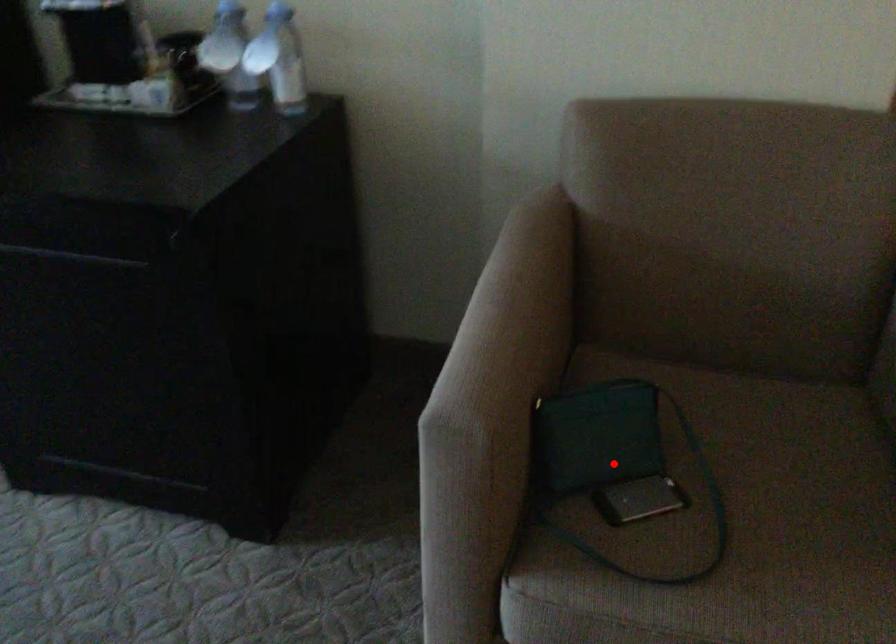
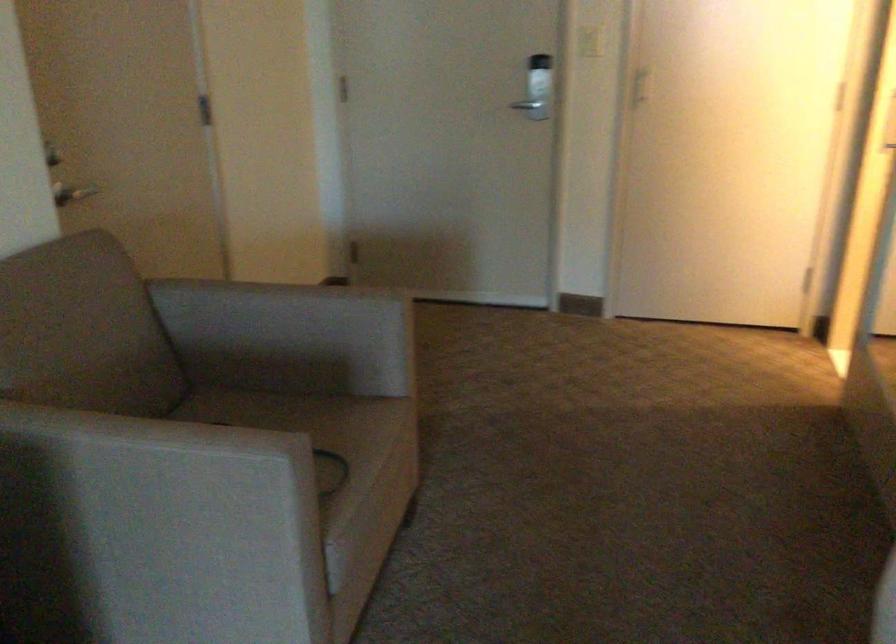
Question: I am providing you with two images of the same scene from different viewpoints. A red point is marked on the first image. At the location where the point appears in image 1, is it still visible in image 2?

Choices:
 (A) Yes
 (B) No

Answer: (B)